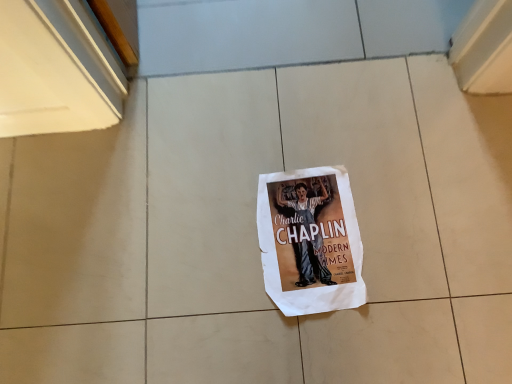
Find the location of `free spot to the right of white paper poster at center`. free spot to the right of white paper poster at center is located at coordinates (414, 198).